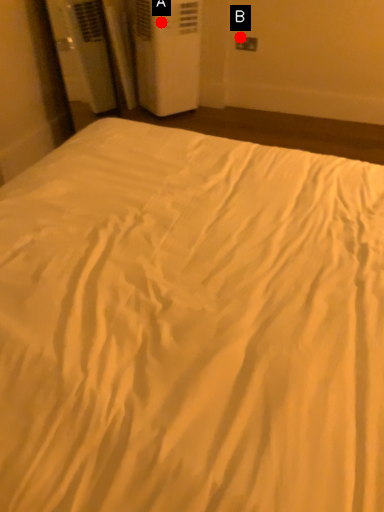
Question: Two points are circled on the image, labeled by A and B beside each circle. Which point appears closest to the camera in this image?

Choices:
 (A) A is closer
 (B) B is closer

Answer: (A)